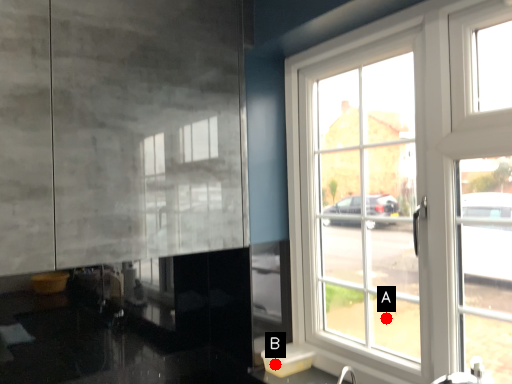
Question: Two points are circled on the image, labeled by A and B beside each circle. Which point is further to the camera?

Choices:
 (A) A is further
 (B) B is further

Answer: (B)